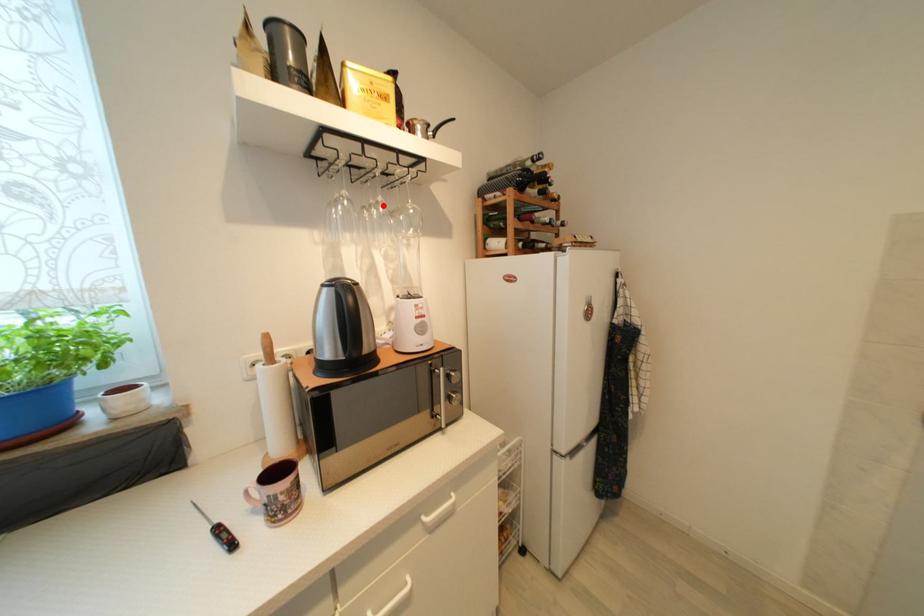
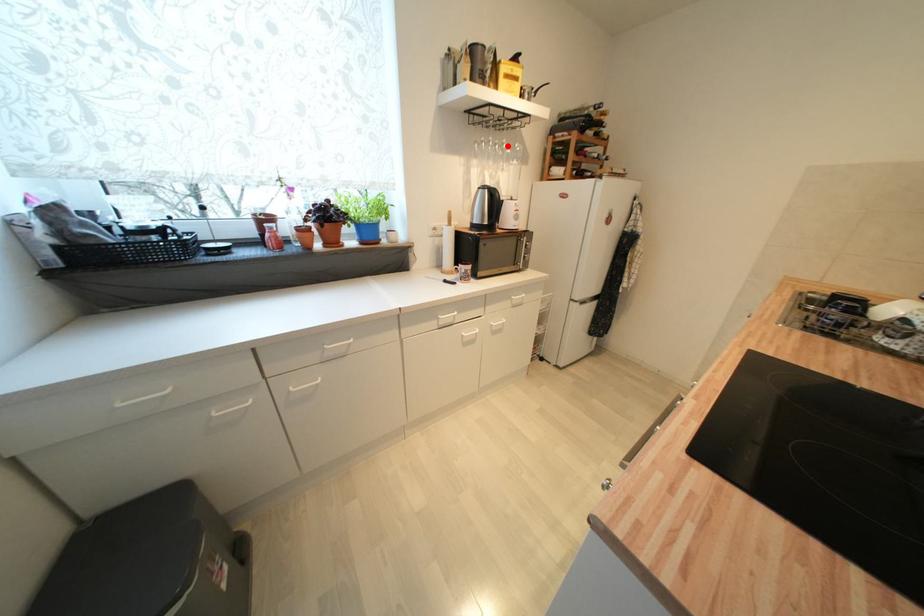
I am providing you with two images of the same scene from different viewpoints. A red point is marked on the first image and another point is marked on the second image. Is the red point in image1 aligned with the point shown in image2?

Yes